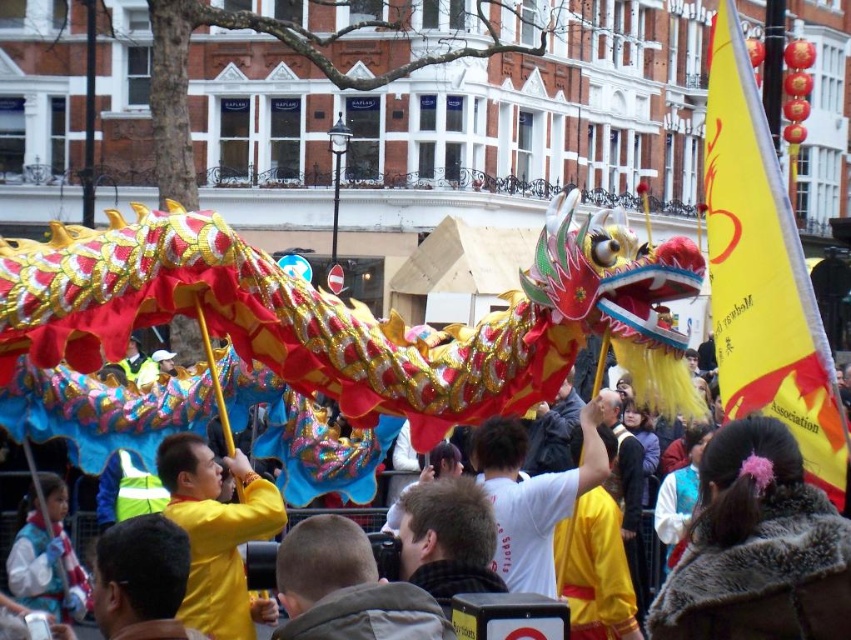
Between yellow fabric at center and yellow fabric headscarf at center, which one is positioned lower?

Positioned lower is yellow fabric headscarf at center.

Between yellow fabric at center and yellow fabric headscarf at center, which one is positioned higher?

yellow fabric at center is above.

The width and height of the screenshot is (851, 640). What are the coordinates of `yellow fabric at center` in the screenshot? It's located at (x=218, y=532).

Can you confirm if fuzzy brown coat at center is positioned above white fleece jacket at lower left?

Indeed, fuzzy brown coat at center is positioned over white fleece jacket at lower left.

Who is higher up, fuzzy brown coat at center or white fleece jacket at lower left?

Positioned higher is fuzzy brown coat at center.

Is point (785, 499) closer to viewer compared to point (9, 589)?

Yes, it is.

Find the location of a particular element. This screenshot has height=640, width=851. fuzzy brown coat at center is located at coordinates (757, 547).

This screenshot has height=640, width=851. What do you see at coordinates (757, 547) in the screenshot?
I see `fuzzy brown coat at center` at bounding box center [757, 547].

Which is in front, point (672, 636) or point (190, 588)?

Point (672, 636)

Which is behind, point (675, 576) or point (195, 456)?

Point (195, 456)

Locate an element on the screen. The image size is (851, 640). fuzzy brown coat at center is located at coordinates coord(757,547).